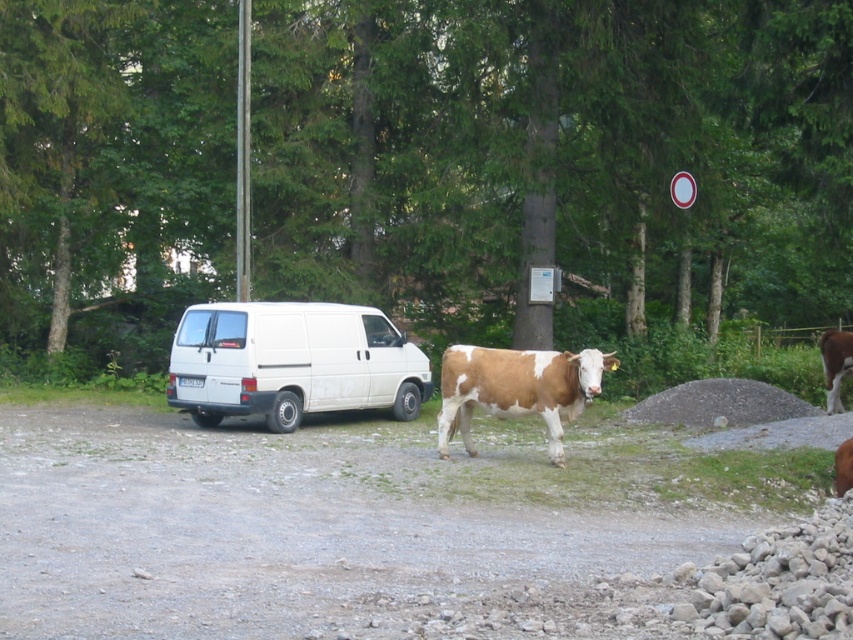
Question: Among these objects, which one is farthest from the camera?

Choices:
 (A) brown speckled hide at right
 (B) white matte van at left
 (C) brown and white textured cow at center

Answer: (A)

Question: Is brown and white textured cow at center wider than brown speckled hide at right?

Choices:
 (A) yes
 (B) no

Answer: (B)

Question: Can you confirm if white matte van at left is bigger than brown speckled hide at right?

Choices:
 (A) no
 (B) yes

Answer: (A)

Question: Estimate the real-world distances between objects in this image. Which object is farther from the brown speckled hide at right?

Choices:
 (A) brown and white textured cow at center
 (B) white matte van at left

Answer: (B)

Question: Is white matte van at left positioned in front of brown and white textured cow at center?

Choices:
 (A) yes
 (B) no

Answer: (B)

Question: Among these points, which one is farthest from the camera?

Choices:
 (A) (370, 324)
 (B) (498, 388)
 (C) (840, 339)

Answer: (C)